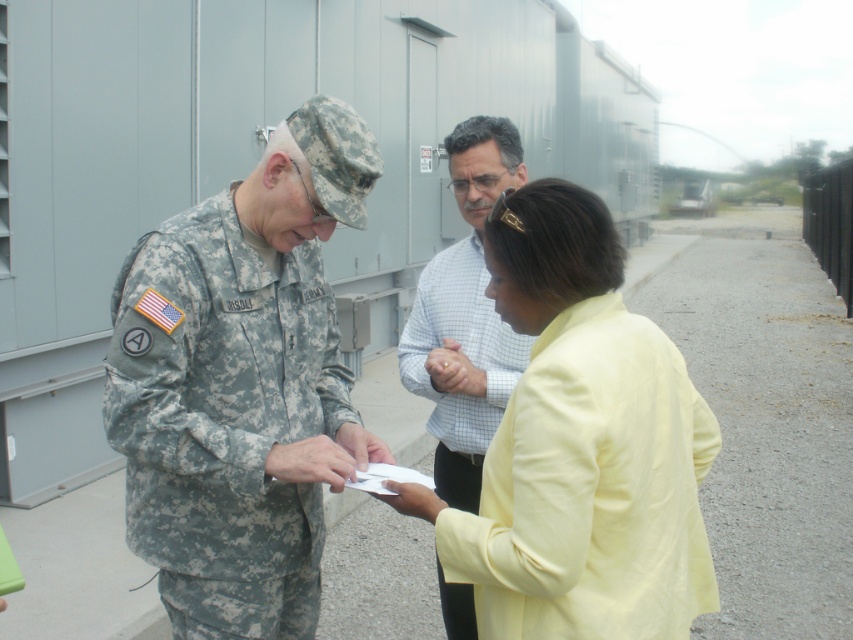
Which is more to the left, camouflage fabric uniform at center or light blue checkered shirt at center?

camouflage fabric uniform at center is more to the left.

Image resolution: width=853 pixels, height=640 pixels. In order to click on camouflage fabric uniform at center in this screenshot , I will do `click(241, 385)`.

Is camouflage fabric uniform at center thinner than yellow fabric jacket at center?

Yes.

Is camouflage fabric uniform at center smaller than yellow fabric jacket at center?

No, camouflage fabric uniform at center is not smaller than yellow fabric jacket at center.

At what (x,y) coordinates should I click in order to perform the action: click on camouflage fabric uniform at center. Please return your answer as a coordinate pair (x, y). Image resolution: width=853 pixels, height=640 pixels. Looking at the image, I should click on (241, 385).

Between yellow fabric jacket at center and light blue checkered shirt at center, which one is positioned lower?

Positioned lower is light blue checkered shirt at center.

Does yellow fabric jacket at center appear on the right side of light blue checkered shirt at center?

Yes, yellow fabric jacket at center is to the right of light blue checkered shirt at center.

At what (x,y) coordinates should I click in order to perform the action: click on yellow fabric jacket at center. Please return your answer as a coordinate pair (x, y). The image size is (853, 640). Looking at the image, I should click on (579, 445).